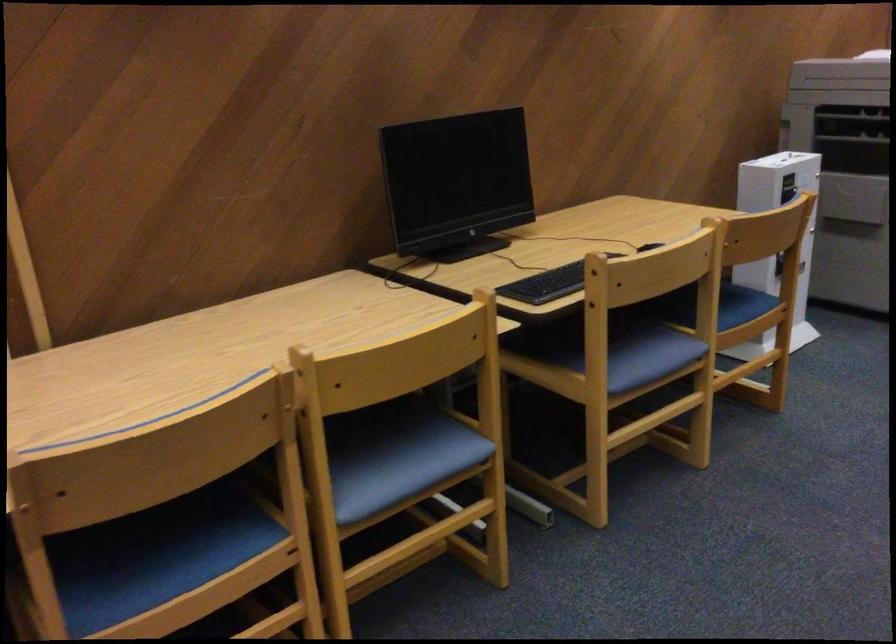
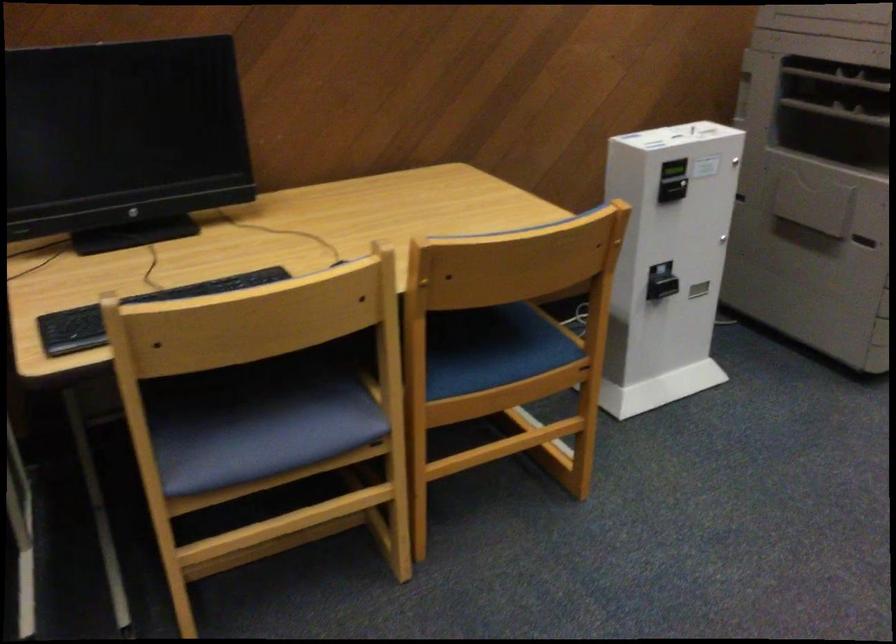
Question: I am providing you with two images of the same scene from different viewpoints. Which of the following objects are not visible in image2?

Choices:
 (A) blue chair sitting surface
 (B) black keyboard
 (C) printer paper tray
 (D) none of these

Answer: (D)